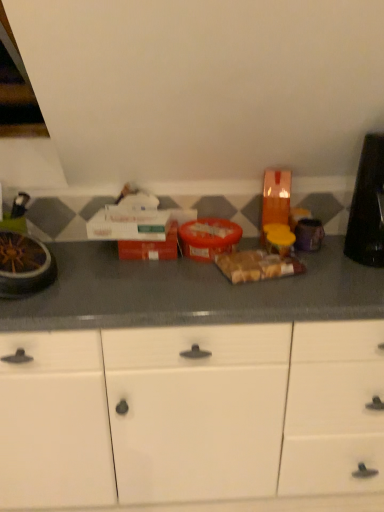
This screenshot has height=512, width=384. Identify the location of vacant space situated on the left part of black plastic toaster at right, the first appliance viewed from the right. (322, 260).